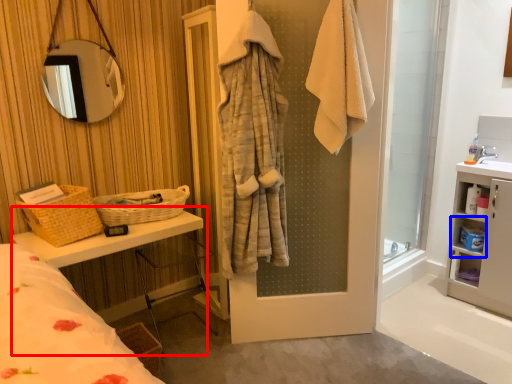
Question: Which point is closer to the camera, vanity (highlighted by a red box) or cabinet (highlighted by a blue box)?

Choices:
 (A) vanity
 (B) cabinet

Answer: (A)